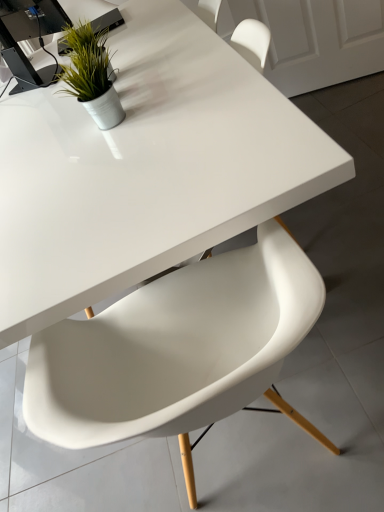
Question: From the image's perspective, is green matte plant at upper left located above or below white plastic chair at center?

Choices:
 (A) below
 (B) above

Answer: (B)

Question: Visually, is green matte plant at upper left positioned to the left or to the right of white plastic chair at center?

Choices:
 (A) right
 (B) left

Answer: (B)

Question: Based on their relative distances, which object is farther from the black plastic computer desk at upper left?

Choices:
 (A) white plastic chair at center
 (B) green matte plant at upper left
 (C) white glossy table at center

Answer: (A)

Question: Which object is positioned closest to the green matte plant at upper left?

Choices:
 (A) black plastic computer desk at upper left
 (B) white plastic chair at center
 (C) white glossy table at center

Answer: (C)